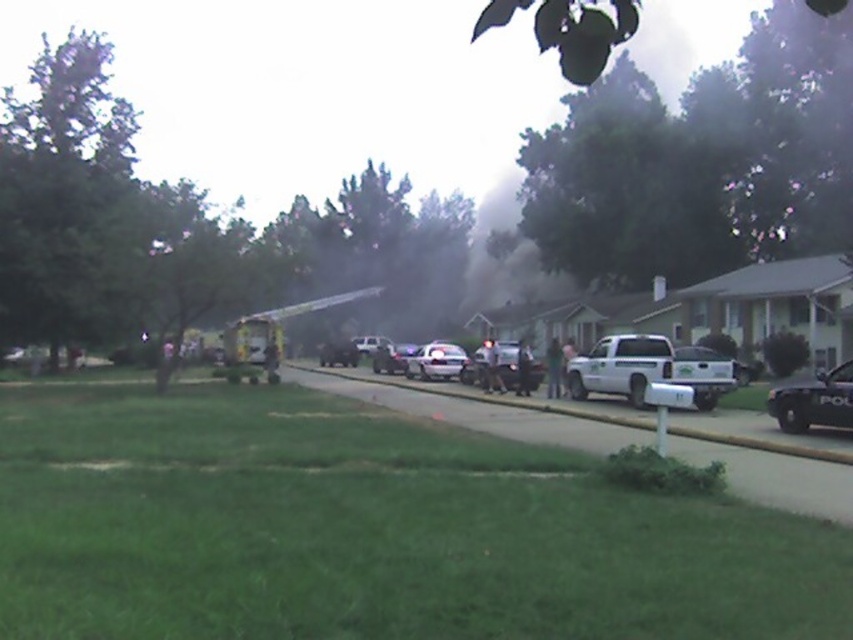
You are a delivery driver who needs to park your van between the yellow reflective fire truck at center and the silver metallic sedan at center on the residential street. Considering the space between them, can your van, which is 2.5 meters wide, fit without overlapping either vehicle?

The yellow reflective fire truck at center is wider than the silver metallic sedan at center. However, the exact width difference isn

You are standing on the residential street depicted in the scene. A fire truck needs to arrive at the scene. Can you safely step aside to let the fire truck pass if you are currently standing 3 meters away from the yellow reflective fire truck at center?

The yellow reflective fire truck at center is 28.40 meters away from the viewer. Since you are only 3 meters away from it, you are within a safe distance and can easily step aside to allow the fire truck to pass through the residential street.